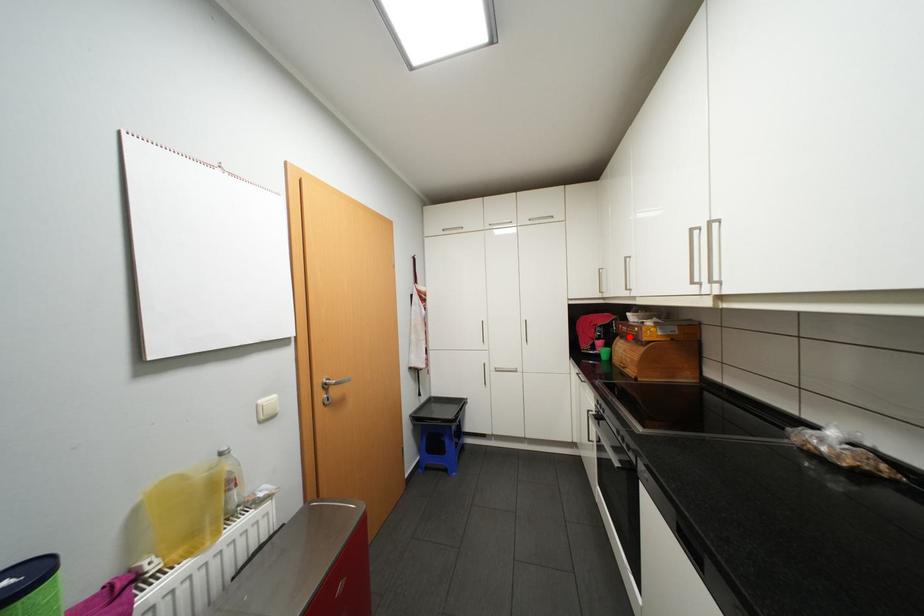
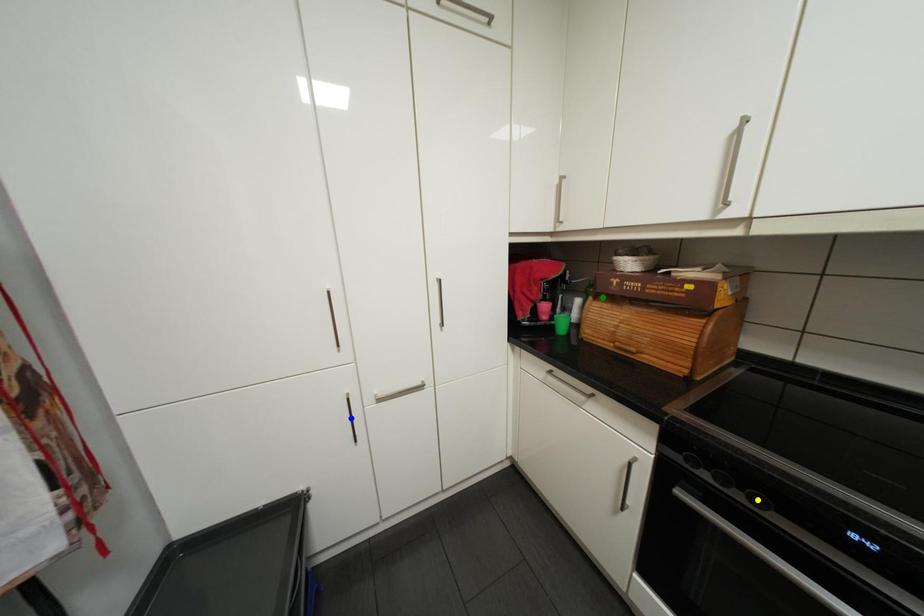
Question: I am providing you with two images of the same scene from different viewpoints. A red point is marked on the first image. You are given multiple points on the second image. Can you choose the point in image 2 that corresponds to the point in image 1?

Choices:
 (A) green point
 (B) yellow point
 (C) blue point

Answer: (A)